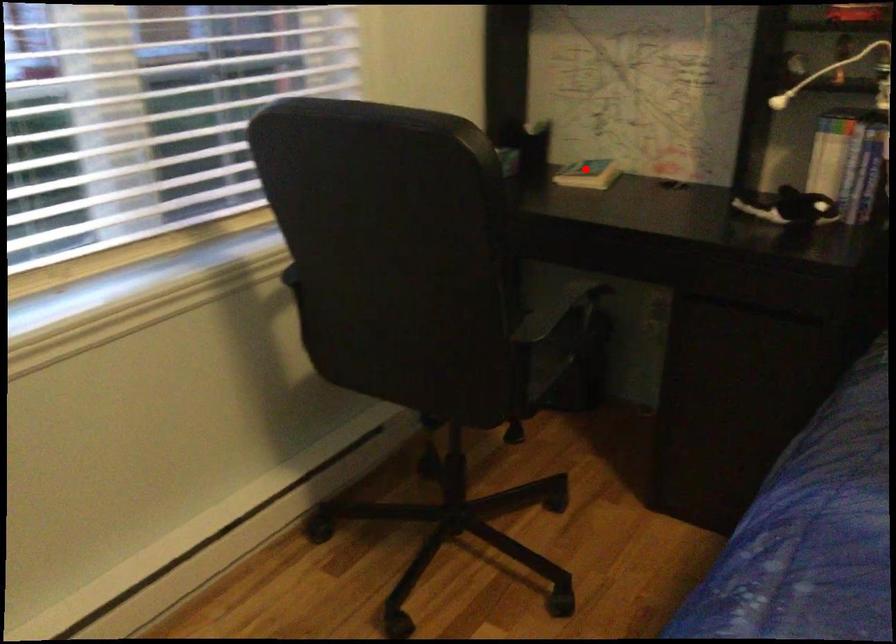
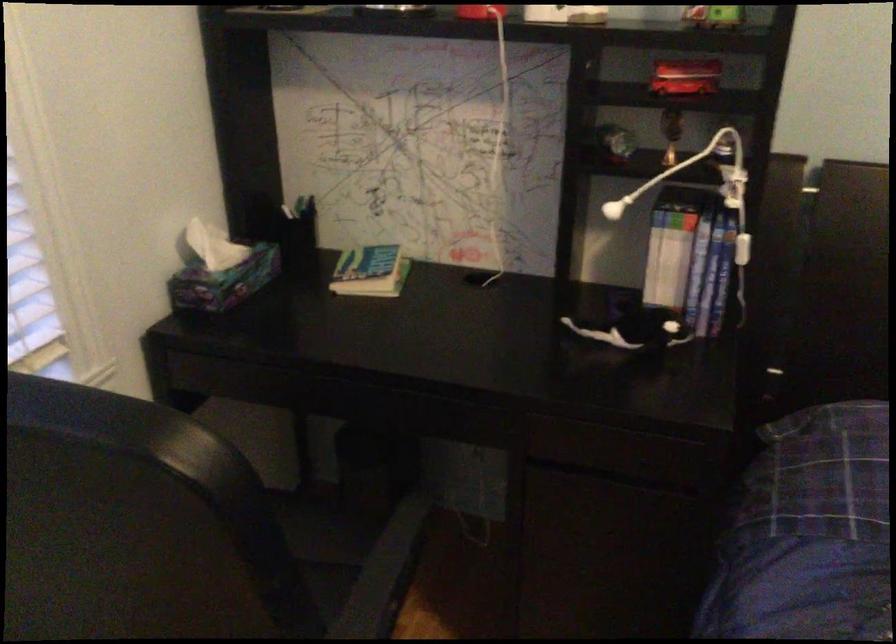
Where in the second image is the point corresponding to the highlighted location from the first image?

(371, 270)